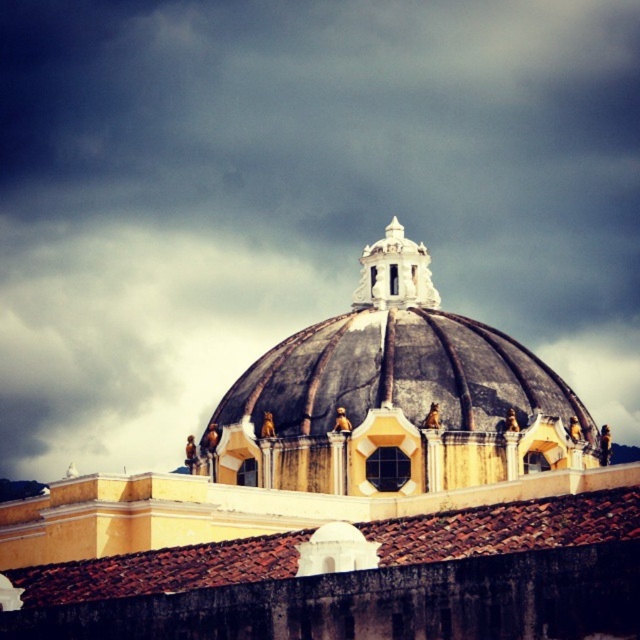
You are standing in front of the building and want to touch the smooth yellow dome at center and the brown tile roof at center. Which one can you reach first without moving your position?

The smooth yellow dome at center is closer to the viewer than the brown tile roof at center, so you can reach the smooth yellow dome at center first.

You are an architect analyzing the building structure. Based on the image, which object is positioned higher in the scene between the dark gray stone dome at center and the brown tile roof at center?

The dark gray stone dome at center is located above the brown tile roof at center, so it is positioned higher in the scene.

You are an architect analyzing the building structure. You notice the smooth yellow dome at center and the white stone spire at center. Which one has a greater height?

The smooth yellow dome at center is taller than the white stone spire at center according to the description.